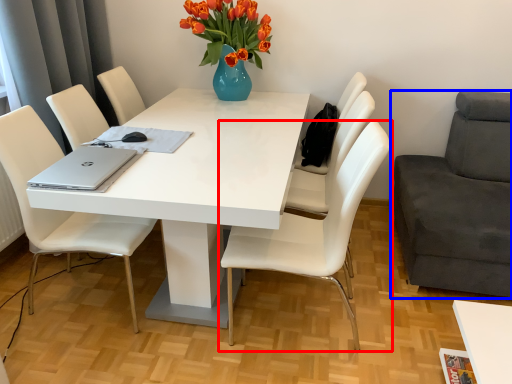
Question: Which object is closer to the camera taking this photo, chair (highlighted by a red box) or chair (highlighted by a blue box)?

Choices:
 (A) chair
 (B) chair

Answer: (B)